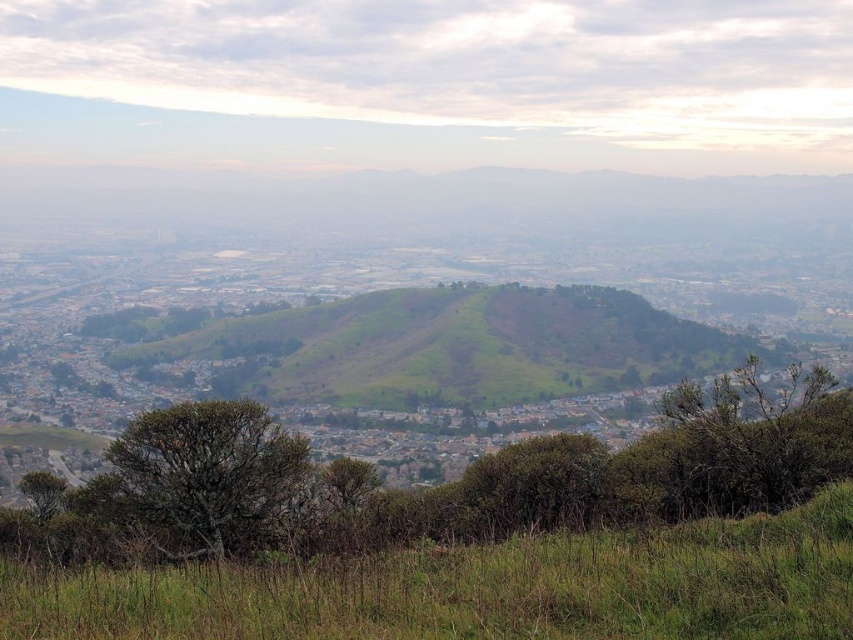
Question: Is green leafy shrub at center below green leafy tree at center?

Choices:
 (A) no
 (B) yes

Answer: (A)

Question: Which point appears farthest from the camera in this image?

Choices:
 (A) (440, 486)
 (B) (146, 528)

Answer: (A)

Question: Which of the following is the closest to the observer?

Choices:
 (A) (819, 536)
 (B) (126, 438)
 (C) (740, 435)

Answer: (A)

Question: Where is green leafy shrub at center located in relation to green grassy at lower center in the image?

Choices:
 (A) below
 (B) above

Answer: (A)

Question: Considering the real-world distances, which object is farthest from the green leafy tree at center?

Choices:
 (A) green leafy shrub at center
 (B) green grassy at lower center

Answer: (B)

Question: Where is green grassy at lower center located in relation to green leafy tree at center in the image?

Choices:
 (A) right
 (B) left

Answer: (A)